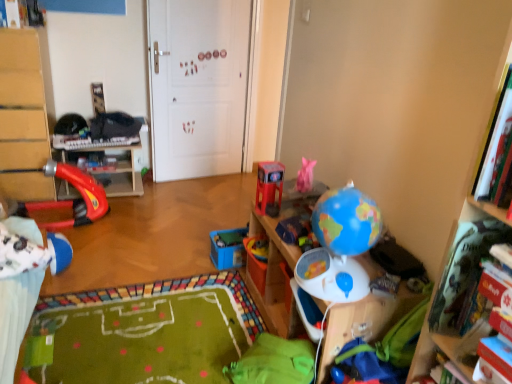
Question: Which direction should I rotate to look at blue plastic globe at center, arranged as the third toy when viewed from the right, — up or down?

Choices:
 (A) down
 (B) up

Answer: (A)

Question: Is blue matte globe at right, acting as the 2th toy starting from the right, located within hardcover book at right, placed as the 2th book when sorted from left to right?

Choices:
 (A) yes
 (B) no

Answer: (B)

Question: Is hardcover book at right, positioned as the second book in top-to-bottom order, at the right side of blue matte globe at right, marked as the 6th toy in a left-to-right arrangement?

Choices:
 (A) no
 (B) yes

Answer: (B)

Question: Can you confirm if hardcover book at right, arranged as the 1th book when viewed from the right, is taller than blue matte globe at right, marked as the 6th toy in a left-to-right arrangement?

Choices:
 (A) no
 (B) yes

Answer: (A)

Question: Is hardcover book at right, which is the first book from bottom to top, wider than blue matte globe at right, acting as the 2th toy starting from the right?

Choices:
 (A) no
 (B) yes

Answer: (A)

Question: Considering the relative positions of hardcover book at right, which is counted as the 1th book, starting from the front, and blue matte globe at right, marked as the 6th toy in a left-to-right arrangement, in the image provided, is hardcover book at right, which is counted as the 1th book, starting from the front, in front of blue matte globe at right, marked as the 6th toy in a left-to-right arrangement,?

Choices:
 (A) no
 (B) yes

Answer: (B)

Question: Can you confirm if hardcover book at right, placed as the 2th book when sorted from left to right, is bigger than blue matte globe at right, marked as the 6th toy in a left-to-right arrangement?

Choices:
 (A) no
 (B) yes

Answer: (A)

Question: Is blue matte globe at right, marked as the 6th toy in a left-to-right arrangement, to the right of blue rubber ball at lower right, which is counted as the first toy, starting from the right, from the viewer's perspective?

Choices:
 (A) no
 (B) yes

Answer: (A)

Question: Considering the relative sizes of blue matte globe at right, acting as the 2th toy starting from the right, and blue rubber ball at lower right, arranged as the 7th toy when viewed from the left, in the image provided, is blue matte globe at right, acting as the 2th toy starting from the right, taller than blue rubber ball at lower right, arranged as the 7th toy when viewed from the left,?

Choices:
 (A) no
 (B) yes

Answer: (B)

Question: Does blue matte globe at right, acting as the 2th toy starting from the right, have a lesser height compared to blue rubber ball at lower right, arranged as the 7th toy when viewed from the left?

Choices:
 (A) yes
 (B) no

Answer: (B)

Question: From the image's perspective, is blue matte globe at right, acting as the 2th toy starting from the right, above blue rubber ball at lower right, which is counted as the first toy, starting from the right?

Choices:
 (A) yes
 (B) no

Answer: (A)

Question: Is blue matte globe at right, acting as the 2th toy starting from the right, beside blue rubber ball at lower right, arranged as the 7th toy when viewed from the left?

Choices:
 (A) yes
 (B) no

Answer: (B)

Question: Does blue matte globe at right, marked as the 6th toy in a left-to-right arrangement, have a larger size compared to blue rubber ball at lower right, which is counted as the first toy, starting from the right?

Choices:
 (A) no
 (B) yes

Answer: (B)

Question: Is blue matte globe at right, marked as the 6th toy in a left-to-right arrangement, bigger than rubberized red slide at left?

Choices:
 (A) yes
 (B) no

Answer: (B)